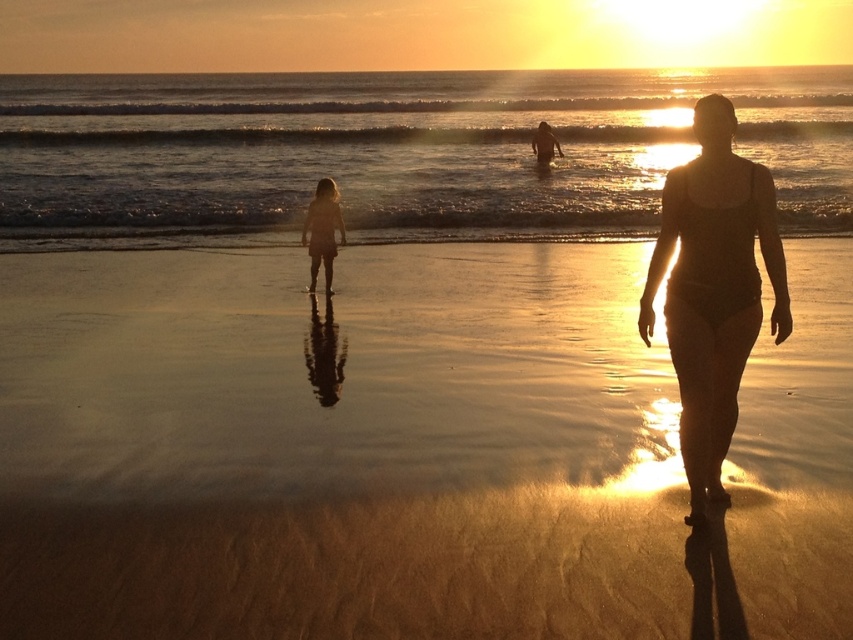
Who is shorter, sandy beach at center or silky blonde hair at center?

Standing shorter between the two is silky blonde hair at center.

Does sandy beach at center come behind silky blonde hair at center?

No, sandy beach at center is closer to the viewer.

The height and width of the screenshot is (640, 853). Find the location of `sandy beach at center`. sandy beach at center is located at coordinates (405, 451).

Who is more distant from viewer, (682, 333) or (331, 196)?

The point (331, 196) is more distant.

Can you confirm if satin black swimsuit at right is positioned below silky blonde hair at center?

Yes.

Does point (744, 356) lie behind point (331, 186)?

No, it is in front of (331, 186).

Find the location of a particular element. satin black swimsuit at right is located at coordinates tap(712, 289).

Between golden reflective water at center and silky blonde hair at center, which one is positioned higher?

Positioned higher is golden reflective water at center.

Identify the location of golden reflective water at center. Image resolution: width=853 pixels, height=640 pixels. (402, 148).

Describe the element at coordinates (402, 148) in the screenshot. I see `golden reflective water at center` at that location.

This screenshot has height=640, width=853. I want to click on golden reflective water at center, so click(402, 148).